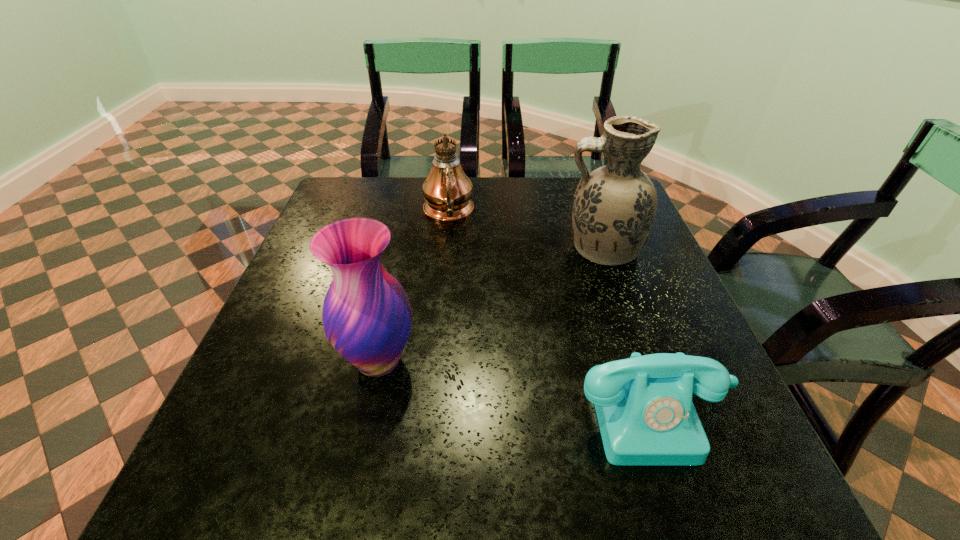
You are a GUI agent. You are given a task and a screenshot of the screen. Output one action in this format:
    pyautogui.click(x=<x>, y=<y>)
    Task: Click on the oil lamp
    This screenshot has height=540, width=960.
    Given the screenshot: What is the action you would take?
    pyautogui.click(x=447, y=190)

At what (x,y) coordinates should I click in order to perform the action: click on the right vase. Please return your answer as a coordinate pair (x, y). The width and height of the screenshot is (960, 540). Looking at the image, I should click on (614, 208).

Where is `the nearer vase`? the nearer vase is located at coordinates (367, 316).

This screenshot has height=540, width=960. I want to click on telephone, so click(646, 416).

This screenshot has width=960, height=540. What are the coordinates of `free space located 0.340m on the front of the oil lamp` in the screenshot? It's located at (437, 328).

The height and width of the screenshot is (540, 960). What are the coordinates of `vacant space located with the handle on the side of the farther vase` in the screenshot? It's located at (426, 249).

At what (x,y) coordinates should I click in order to perform the action: click on vacant position located with the handle on the side of the farther vase. Please return your answer as a coordinate pair (x, y). This screenshot has height=540, width=960. Looking at the image, I should click on (473, 249).

This screenshot has height=540, width=960. Identify the location of vacant space located with the handle on the side of the farther vase. (537, 249).

Where is `vacant space positioned on the back of the left vase`? This screenshot has width=960, height=540. vacant space positioned on the back of the left vase is located at coordinates (393, 298).

You are a GUI agent. You are given a task and a screenshot of the screen. Output one action in this format:
    pyautogui.click(x=<x>, y=<y>)
    Task: Click on the vacant space situated 0.050m on the dial of the shortest object
    This screenshot has width=960, height=540.
    Given the screenshot: What is the action you would take?
    pyautogui.click(x=684, y=499)